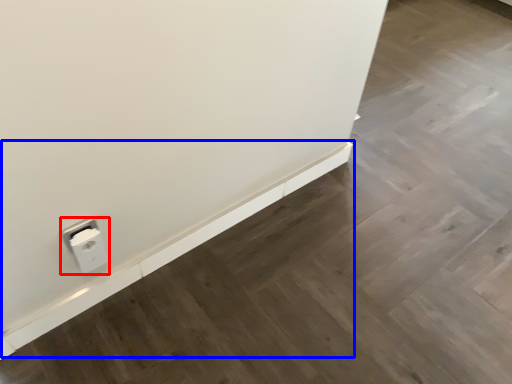
Question: Which object is further to the camera taking this photo, power plugs and sockets (highlighted by a red box) or ledge (highlighted by a blue box)?

Choices:
 (A) power plugs and sockets
 (B) ledge

Answer: (B)